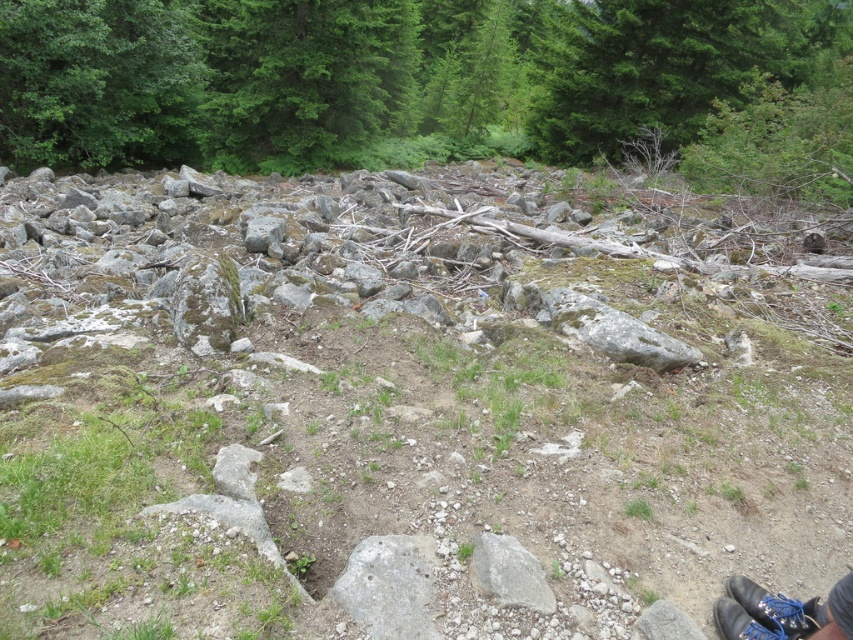
Between point (178, 51) and point (796, 604), which one is positioned in front?

Point (796, 604) is more forward.

Is green leafy tree at upper center to the left of black leather shoe at lower right from the viewer's perspective?

Incorrect, green leafy tree at upper center is not on the left side of black leather shoe at lower right.

Where is `green leafy tree at upper center`? Image resolution: width=853 pixels, height=640 pixels. green leafy tree at upper center is located at coordinates (381, 74).

Identify the location of green leafy tree at upper center. (381, 74).

Who is lower down, gray rock pile at center or black leather shoe at lower right?

black leather shoe at lower right

Can you confirm if gray rock pile at center is positioned below black leather shoe at lower right?

No.

What do you see at coordinates (393, 419) in the screenshot?
I see `gray rock pile at center` at bounding box center [393, 419].

This screenshot has height=640, width=853. Identify the location of gray rock pile at center. (393, 419).

Which is behind, point (262, 3) or point (403, 627)?

Positioned behind is point (262, 3).

Can you confirm if green leafy tree at upper center is thinner than gray rough rock at center?

Incorrect, green leafy tree at upper center's width is not less than gray rough rock at center's.

Where is `green leafy tree at upper center`? The height and width of the screenshot is (640, 853). green leafy tree at upper center is located at coordinates 381,74.